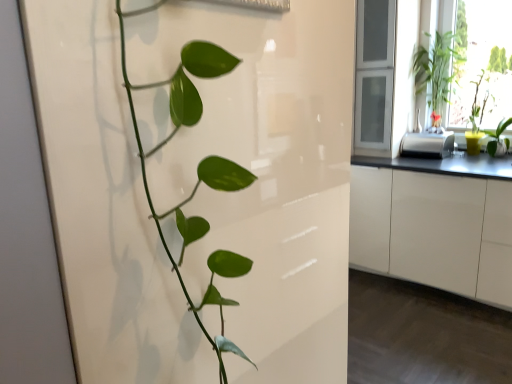
Question: Is green glossy plant at right, the 1th houseplant from the right, to the right of yellow matte pot at right, marked as the 2th houseplant in a back-to-front arrangement, from the viewer's perspective?

Choices:
 (A) no
 (B) yes

Answer: (B)

Question: Is green glossy plant at right, marked as the 4th houseplant in a left-to-right arrangement, smaller than yellow matte pot at right, which appears as the 3th houseplant when viewed from the front?

Choices:
 (A) no
 (B) yes

Answer: (B)

Question: Is green glossy plant at right, marked as the 4th houseplant in a left-to-right arrangement, not inside yellow matte pot at right, acting as the 3th houseplant starting from the left?

Choices:
 (A) yes
 (B) no

Answer: (A)

Question: Are green glossy plant at right, the 1th houseplant from the right, and yellow matte pot at right, which ranks as the 2th houseplant in right-to-left order, making contact?

Choices:
 (A) no
 (B) yes

Answer: (A)

Question: Can you confirm if green glossy plant at right, marked as the 4th houseplant in a left-to-right arrangement, is wider than yellow matte pot at right, marked as the 2th houseplant in a back-to-front arrangement?

Choices:
 (A) no
 (B) yes

Answer: (A)

Question: From a real-world perspective, is green glossy plant at right, the 1th houseplant from the right, positioned under yellow matte pot at right, which ranks as the 2th houseplant in right-to-left order, based on gravity?

Choices:
 (A) no
 (B) yes

Answer: (B)

Question: Is satin silver toaster at right positioned with its back to yellow matte pot at right, which appears as the 3th houseplant when viewed from the front?

Choices:
 (A) yes
 (B) no

Answer: (B)

Question: From the image's perspective, does satin silver toaster at right appear higher than yellow matte pot at right, marked as the 2th houseplant in a back-to-front arrangement?

Choices:
 (A) yes
 (B) no

Answer: (B)

Question: Would you say yellow matte pot at right, acting as the 3th houseplant starting from the left, is part of satin silver toaster at right's contents?

Choices:
 (A) yes
 (B) no

Answer: (B)

Question: Does satin silver toaster at right lie in front of yellow matte pot at right, acting as the 3th houseplant starting from the left?

Choices:
 (A) no
 (B) yes

Answer: (A)

Question: Is satin silver toaster at right positioned behind yellow matte pot at right, marked as the 2th houseplant in a back-to-front arrangement?

Choices:
 (A) no
 (B) yes

Answer: (B)

Question: From a real-world perspective, is satin silver toaster at right located beneath yellow matte pot at right, acting as the 3th houseplant starting from the left?

Choices:
 (A) no
 (B) yes

Answer: (B)

Question: Considering the relative sizes of clear glass window frame at upper right and green glossy plant at right, positioned as the 3th houseplant in back-to-front order, in the image provided, is clear glass window frame at upper right wider than green glossy plant at right, positioned as the 3th houseplant in back-to-front order,?

Choices:
 (A) no
 (B) yes

Answer: (B)